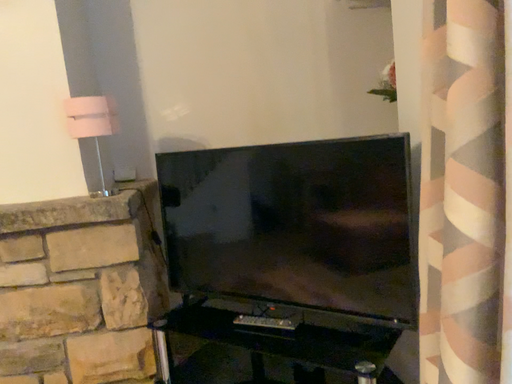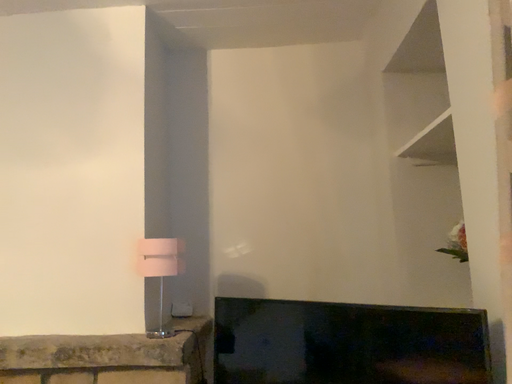
Question: How did the camera likely rotate when shooting the video?

Choices:
 (A) rotated upward
 (B) rotated downward

Answer: (A)